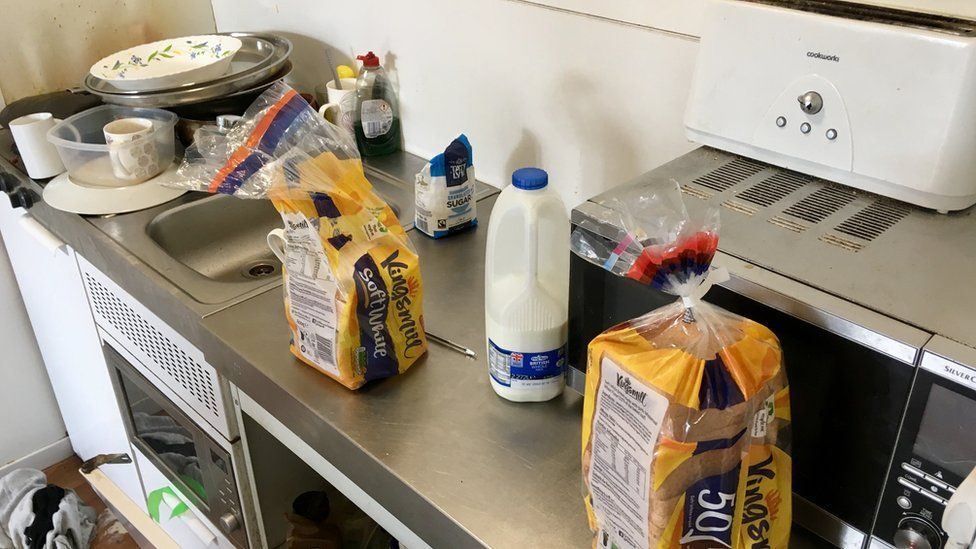
The image size is (976, 549). I want to click on wall, so click(608, 63), click(506, 52), click(450, 70).